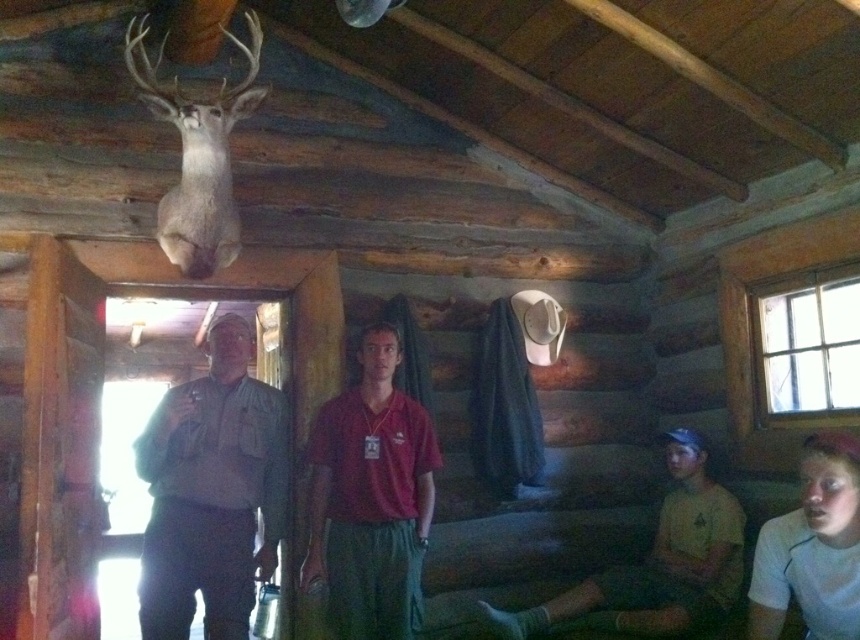
Question: Where is matte red shirt at center located in relation to yellow-green fabric at lower right in the image?

Choices:
 (A) above
 (B) below

Answer: (A)

Question: Which of the following is the closest to the observer?

Choices:
 (A) yellow-green fabric at lower right
 (B) matte khaki shirt at center

Answer: (B)

Question: Does matte khaki shirt at center have a lesser width compared to yellow-green fabric at lower right?

Choices:
 (A) no
 (B) yes

Answer: (B)

Question: Estimate the real-world distances between objects in this image. Which object is farther from the matte red shirt at center?

Choices:
 (A) yellow-green fabric at lower right
 (B) matte khaki shirt at center

Answer: (A)

Question: Which of the following is the closest to the observer?

Choices:
 (A) (142, 573)
 (B) (616, 616)
 (C) (320, 497)

Answer: (A)

Question: Is matte red shirt at center below yellow-green fabric at lower right?

Choices:
 (A) yes
 (B) no

Answer: (B)